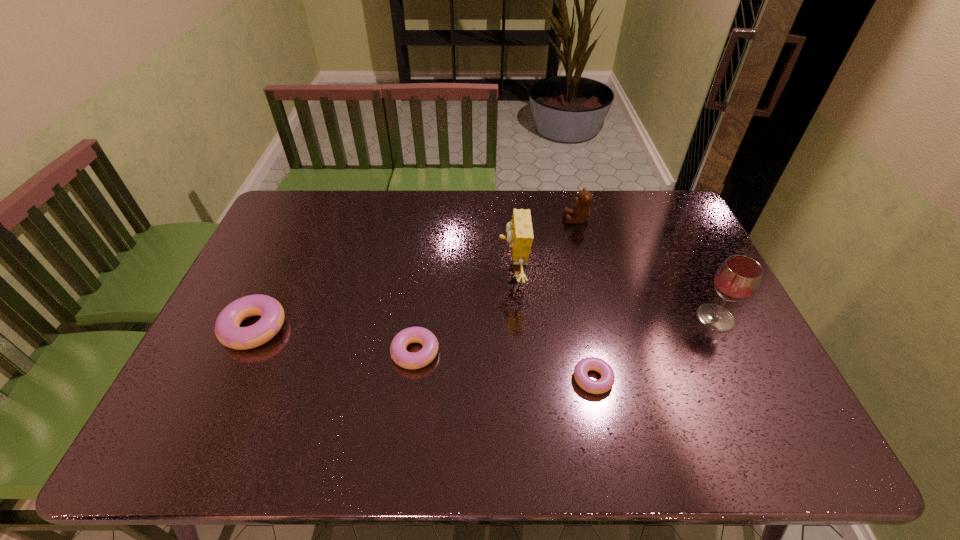
Find the location of a particular element. The width and height of the screenshot is (960, 540). vacant place for an extra doughnut on the right is located at coordinates (790, 408).